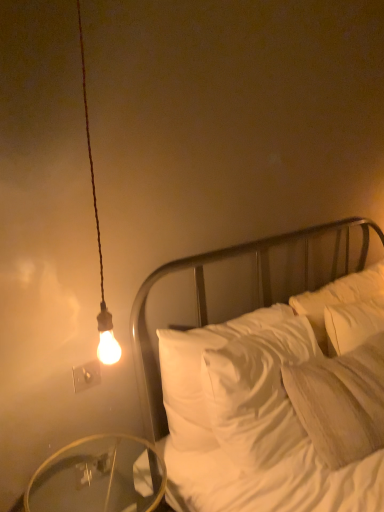
Question: Is point (311, 381) positioned closer to the camera than point (79, 386)?

Choices:
 (A) farther
 (B) closer

Answer: (A)

Question: From the image's perspective, relative to white plastic electric outlet at upper left, is white soft pillow at right above or below?

Choices:
 (A) below
 (B) above

Answer: (B)

Question: Based on their relative distances, which object is nearer to the white soft pillow at right?

Choices:
 (A) transparent glass table at lower left
 (B) white plastic electric outlet at upper left
 (C) white satin bed at center

Answer: (C)

Question: Estimate the real-world distances between objects in this image. Which object is farther from the white plastic electric outlet at upper left?

Choices:
 (A) white soft pillow at right
 (B) transparent glass table at lower left
 (C) white satin bed at center

Answer: (A)